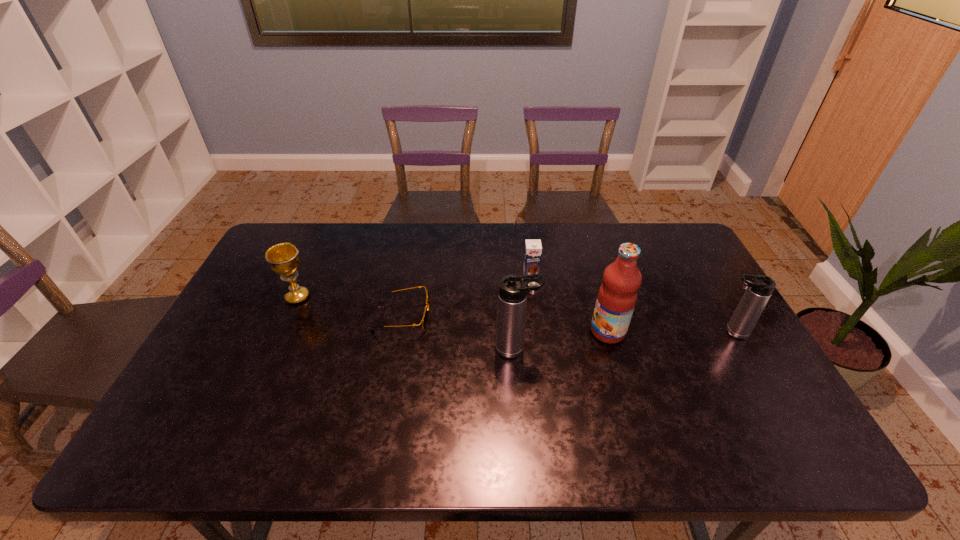
I want to click on the left thermos bottle, so click(512, 296).

Where is `the taller thermos bottle`? This screenshot has width=960, height=540. the taller thermos bottle is located at coordinates (512, 296).

Where is `the shorter thermos bottle`? Image resolution: width=960 pixels, height=540 pixels. the shorter thermos bottle is located at coordinates (759, 288).

You are a GUI agent. You are given a task and a screenshot of the screen. Output one action in this format:
    pyautogui.click(x=<x>, y=<y>)
    Task: Click on the rightmost object
    
    Given the screenshot: What is the action you would take?
    pyautogui.click(x=759, y=288)

Where is `the shortest object`? Image resolution: width=960 pixels, height=540 pixels. the shortest object is located at coordinates (425, 318).

This screenshot has height=540, width=960. What are the coordinates of `the second object from left to right` in the screenshot? It's located at (425, 318).

Find the location of `the farthest object`. the farthest object is located at coordinates [533, 249].

Locate an element on the screen. chocolate milk is located at coordinates (533, 249).

The height and width of the screenshot is (540, 960). Find the location of `chalice`. chalice is located at coordinates coord(283,258).

Find the location of `the second object from right to left`. the second object from right to left is located at coordinates (617, 295).